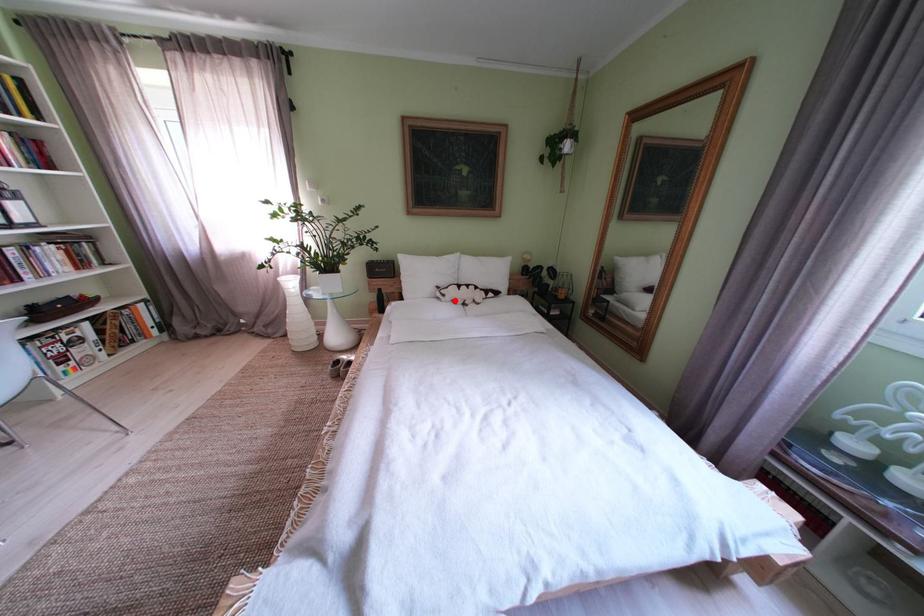
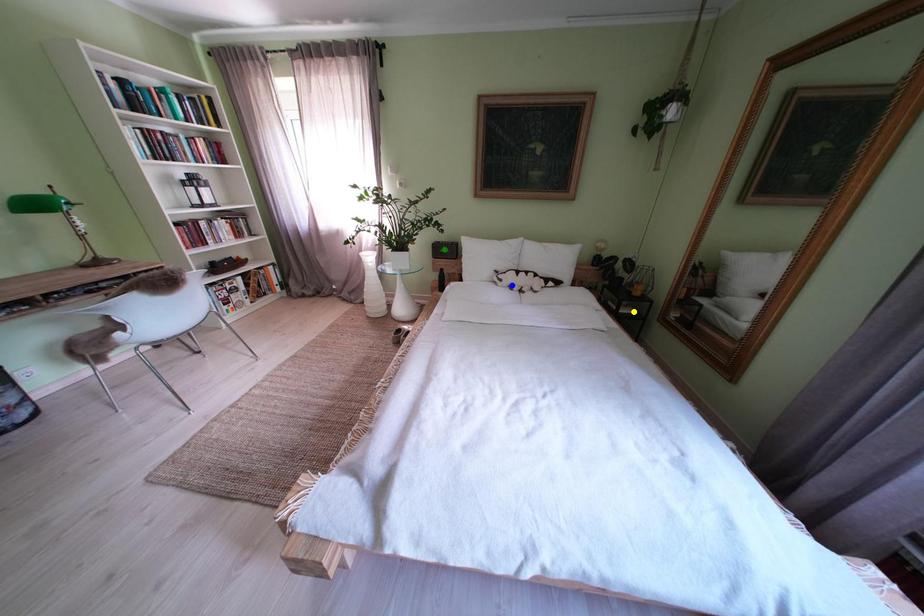
Question: I am providing you with two images of the same scene from different viewpoints. A red point is marked on the first image. You are given multiple points on the second image. Which spot in image 2 lines up with the point in image 1?

Choices:
 (A) yellow point
 (B) blue point
 (C) green point

Answer: (B)